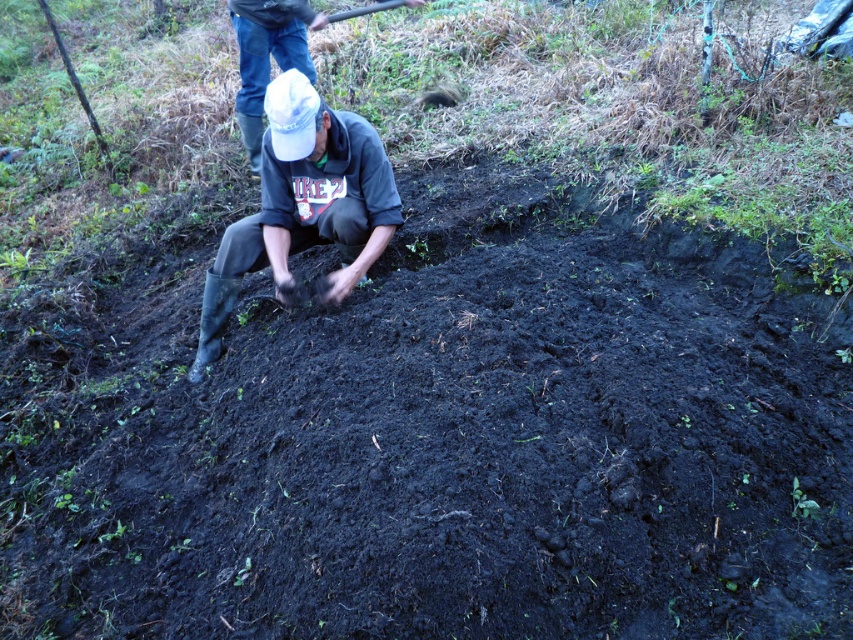
Question: Which point is closer to the camera?

Choices:
 (A) (270, 189)
 (B) (242, 116)

Answer: (A)

Question: Among these objects, which one is farthest from the camera?

Choices:
 (A) denim jeans at upper center
 (B) rubber boots at center

Answer: (A)

Question: From the image, what is the correct spatial relationship of rubber boots at center in relation to denim jeans at upper center?

Choices:
 (A) above
 (B) below

Answer: (B)

Question: Can you confirm if rubber boots at center is bigger than denim jeans at upper center?

Choices:
 (A) yes
 (B) no

Answer: (A)

Question: Does rubber boots at center appear under denim jeans at upper center?

Choices:
 (A) yes
 (B) no

Answer: (A)